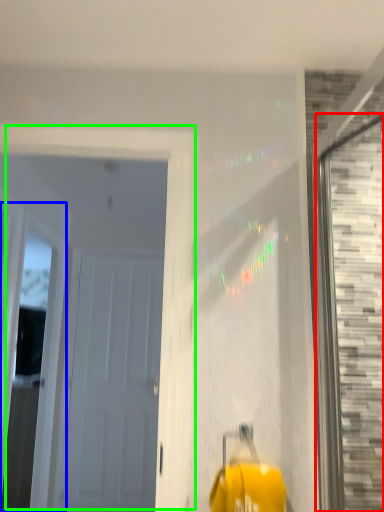
Question: Estimate the real-world distances between objects in this image. Which object is closer to window (highlighted by a red box), window (highlighted by a blue box) or door (highlighted by a green box)?

Choices:
 (A) window
 (B) door

Answer: (B)